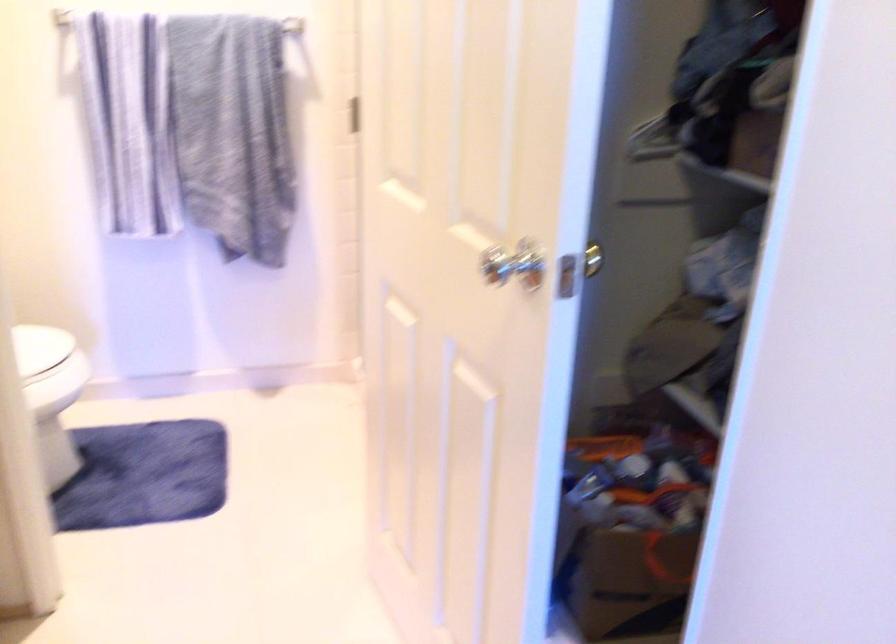
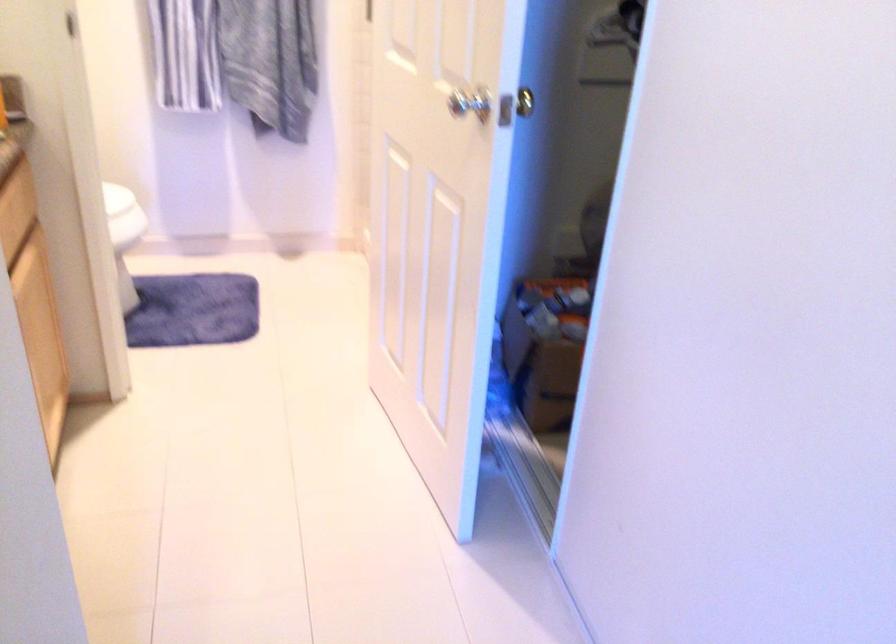
Question: I am providing you with two images of the same scene from different viewpoints. Please identify which objects are invisible in image2.

Choices:
 (A) white toilet lid
 (B) white pitcher
 (C) silver door handle
 (D) cabinet drawer handle

Answer: (A)